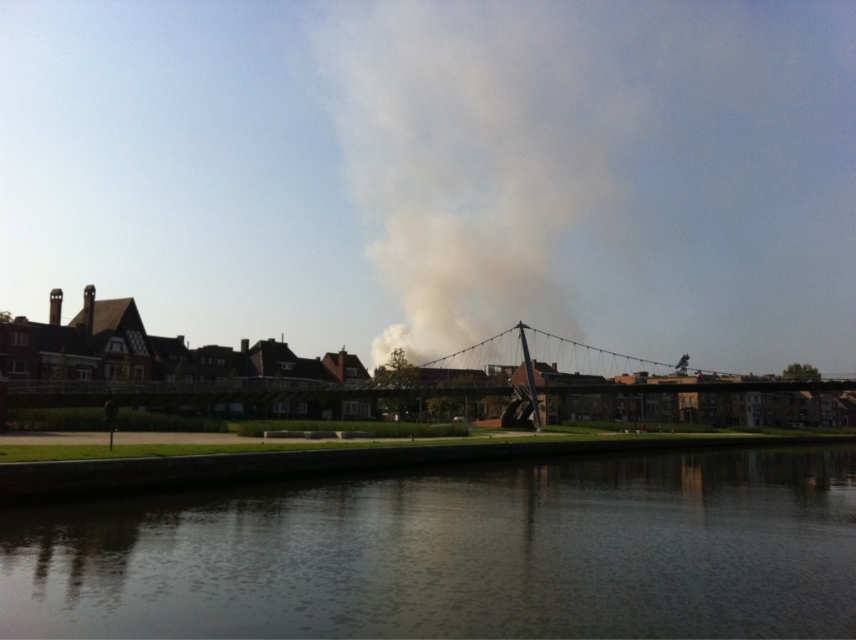
Question: Which point is closer to the camera?

Choices:
 (A) metallic gray suspension bridge at center
 (B) dark reflective water at lower center
 (C) gray smoke at center

Answer: (B)

Question: Is dark reflective water at lower center thinner than metallic gray suspension bridge at center?

Choices:
 (A) yes
 (B) no

Answer: (A)

Question: Is dark reflective water at lower center positioned before metallic gray suspension bridge at center?

Choices:
 (A) yes
 (B) no

Answer: (A)

Question: Which is farther from the gray smoke at center?

Choices:
 (A) metallic gray suspension bridge at center
 (B) dark reflective water at lower center

Answer: (B)

Question: Can you confirm if dark reflective water at lower center is positioned to the left of gray smoke at center?

Choices:
 (A) yes
 (B) no

Answer: (A)

Question: Which object is closer to the camera taking this photo?

Choices:
 (A) metallic gray suspension bridge at center
 (B) gray smoke at center

Answer: (A)